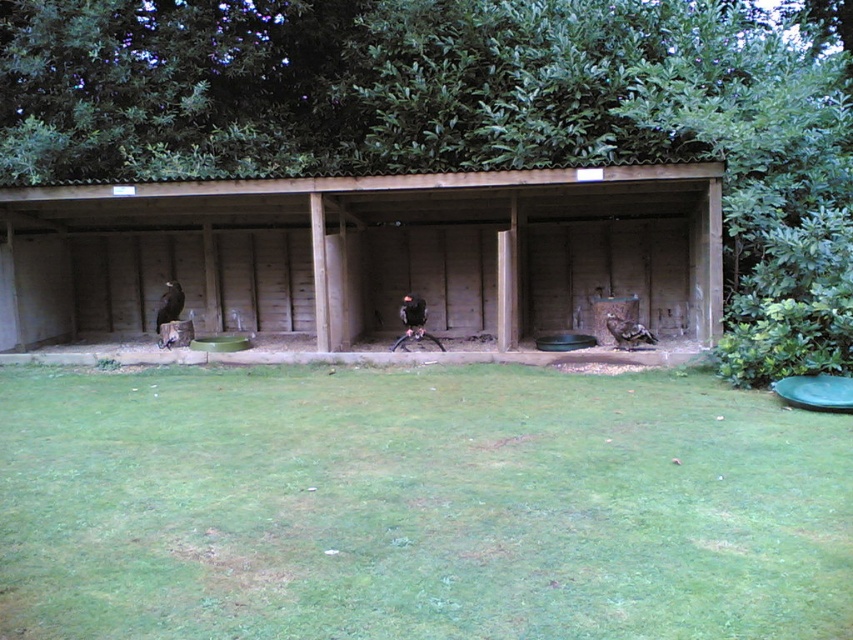
Question: Which point appears farthest from the camera in this image?

Choices:
 (A) (175, 618)
 (B) (250, 298)

Answer: (B)

Question: Which of the following is the farthest from the observer?

Choices:
 (A) brown wooden hut at center
 (B) green grass at center

Answer: (A)

Question: Can you confirm if green grass at center is positioned below brown wooden hut at center?

Choices:
 (A) yes
 (B) no

Answer: (A)

Question: Which point is closer to the camera?

Choices:
 (A) green grass at center
 (B) brown wooden hut at center

Answer: (A)

Question: Is green grass at center wider than brown wooden hut at center?

Choices:
 (A) yes
 (B) no

Answer: (B)

Question: Is green grass at center wider than brown wooden hut at center?

Choices:
 (A) yes
 (B) no

Answer: (B)